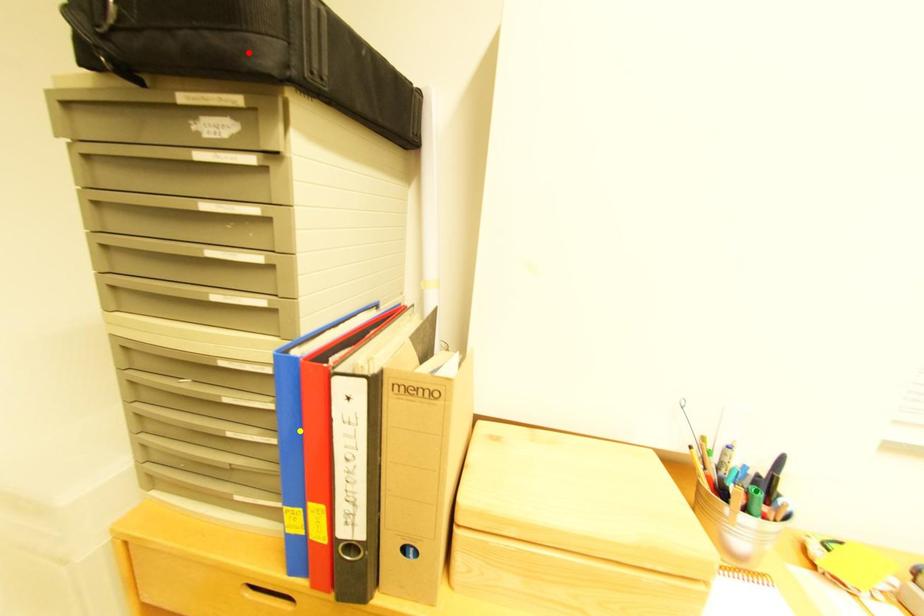
Order these from nearest to farthest:
red point
yellow point
green point

green point → yellow point → red point